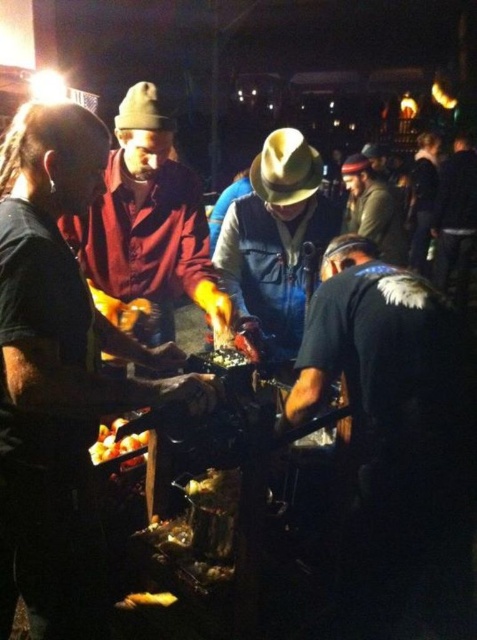
In the nighttime outdoor cooking scene, there are two people wearing distinctive clothing items. One is a red shirt and beanie, and the other is a denim vest and a light colored hat. You notice a point at coordinates point [373,209]. Which clothing item is this point located on?

The point [373,209] is on the green felt hat at upper right.

What are the coordinates of the green felt hat at upper right in the image?

The coordinates of the green felt hat at upper right are at point [373,209].